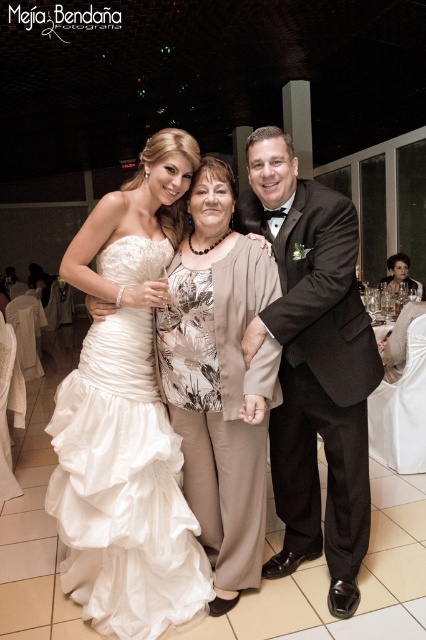
Question: Is black satin suit at center to the left of floral print blouse at center from the viewer's perspective?

Choices:
 (A) no
 (B) yes

Answer: (A)

Question: Which object is positioned closest to the floral print blouse at center?

Choices:
 (A) matte black dress at center
 (B) white satin dress at left
 (C) black satin suit at center

Answer: (C)

Question: Is white satin dress at left to the left of floral print blouse at center from the viewer's perspective?

Choices:
 (A) no
 (B) yes

Answer: (B)

Question: Is floral print blouse at center below matte black dress at center?

Choices:
 (A) no
 (B) yes

Answer: (B)

Question: Considering the real-world distances, which object is closest to the black satin suit at center?

Choices:
 (A) floral print blouse at center
 (B) matte black dress at center

Answer: (A)

Question: Which object appears farthest from the camera in this image?

Choices:
 (A) black satin suit at center
 (B) matte black dress at center

Answer: (B)